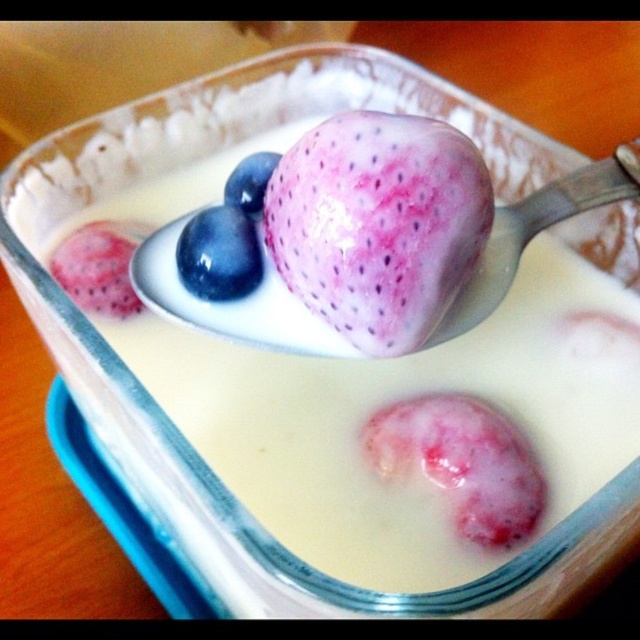
Between satin silver spoon at upper center and pink glossy strawberry at upper center, which one is positioned lower?

pink glossy strawberry at upper center is below.

Does satin silver spoon at upper center have a greater width compared to pink glossy strawberry at upper center?

Correct, the width of satin silver spoon at upper center exceeds that of pink glossy strawberry at upper center.

Is point (620, 196) less distant than point (97, 237)?

Yes, it is in front of point (97, 237).

Image resolution: width=640 pixels, height=640 pixels. In order to click on satin silver spoon at upper center in this screenshot , I will do `click(536, 232)`.

Is blue glossy blueberry at center below blue matte/black glossy blueberry at upper center?

Indeed, blue glossy blueberry at center is positioned under blue matte/black glossy blueberry at upper center.

Who is more forward, (179, 253) or (243, 176)?

Point (179, 253) is more forward.

Who is more distant from viewer, [259,259] or [246,211]?

The point [246,211] is more distant.

In order to click on blue glossy blueberry at center in this screenshot , I will do `click(220, 253)`.

Measure the distance from pink glossy fruit at center to satin silver spoon at upper center.

pink glossy fruit at center is 11.90 centimeters away from satin silver spoon at upper center.

Can you confirm if pink glossy fruit at center is smaller than satin silver spoon at upper center?

Indeed, pink glossy fruit at center has a smaller size compared to satin silver spoon at upper center.

Is point (432, 275) positioned before point (516, 257)?

Yes, point (432, 275) is closer to viewer.

Identify the location of pink glossy fruit at center. (378, 225).